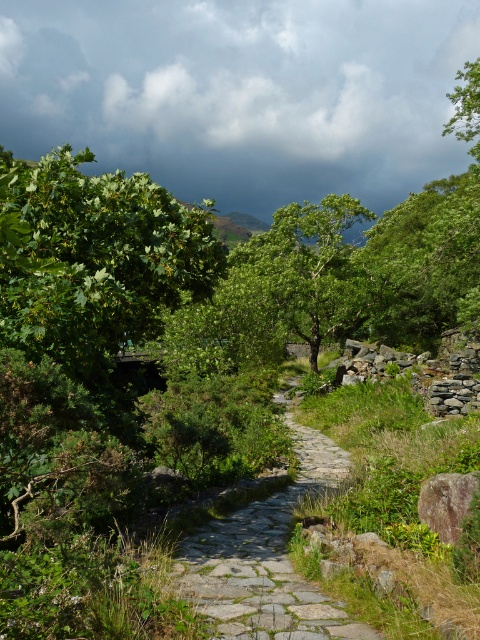
Between point (205, 612) and point (357, 288), which one is positioned in front?

Positioned in front is point (205, 612).

Looking at this image, between stone paved path at center and green leafy tree at center, which one has more height?

Standing taller between the two is green leafy tree at center.

Image resolution: width=480 pixels, height=640 pixels. What do you see at coordinates (266, 561) in the screenshot? I see `stone paved path at center` at bounding box center [266, 561].

Where is `stone paved path at center`? The height and width of the screenshot is (640, 480). stone paved path at center is located at coordinates (266, 561).

Is stone paved path at center shorter than gray rough rock at center-right?

Incorrect, stone paved path at center's height does not fall short of gray rough rock at center-right's.

This screenshot has height=640, width=480. Identify the location of stone paved path at center. pyautogui.click(x=266, y=561).

Between green leafy tree at center and gray rough rock at center-right, which one is positioned higher?

Positioned higher is green leafy tree at center.

Which of these two, green leafy tree at center or gray rough rock at center-right, stands shorter?

gray rough rock at center-right

Does point (248, 262) lie in front of point (468, 483)?

No.

Find the location of `green leafy tree at center`. green leafy tree at center is located at coordinates (309, 268).